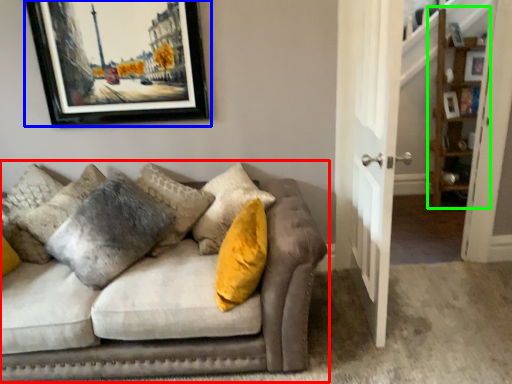
Question: Estimate the real-world distances between objects in this image. Which object is closer to studio couch (highlighted by a red box), picture frame (highlighted by a blue box) or shelf (highlighted by a green box)?

Choices:
 (A) picture frame
 (B) shelf

Answer: (A)